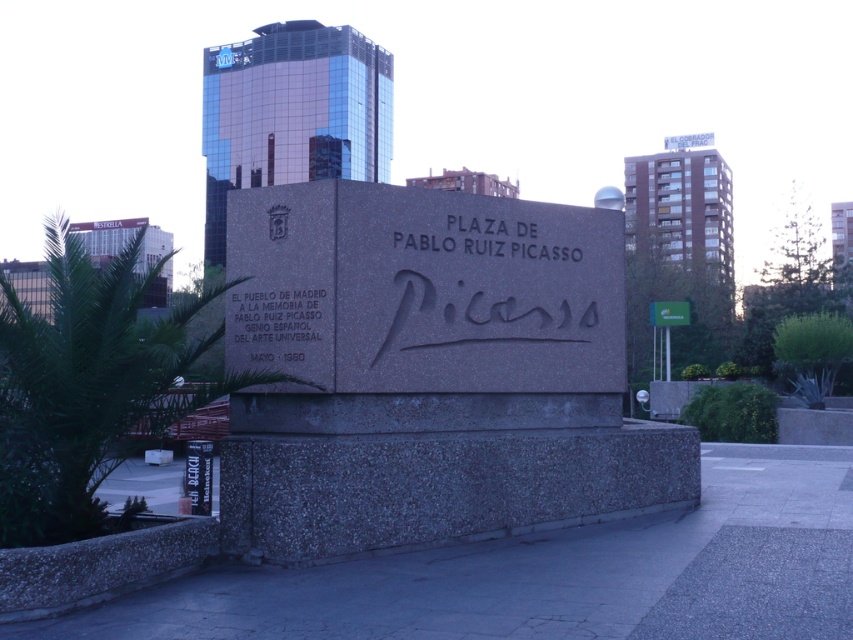
Can you confirm if gray granite sign at center is positioned to the left of matte stone inscription at center?

No, gray granite sign at center is not to the left of matte stone inscription at center.

Image resolution: width=853 pixels, height=640 pixels. In order to click on gray granite sign at center in this screenshot , I will do `click(436, 372)`.